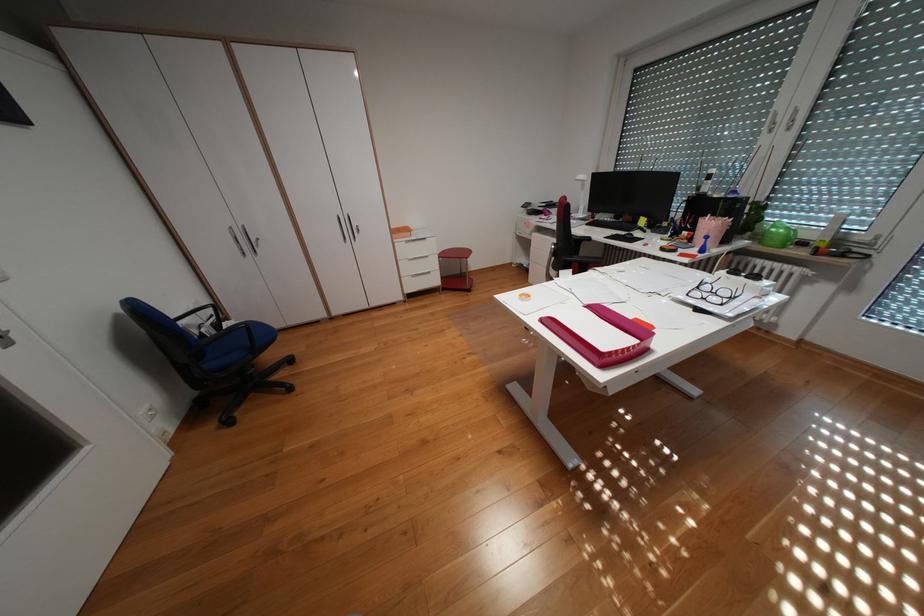
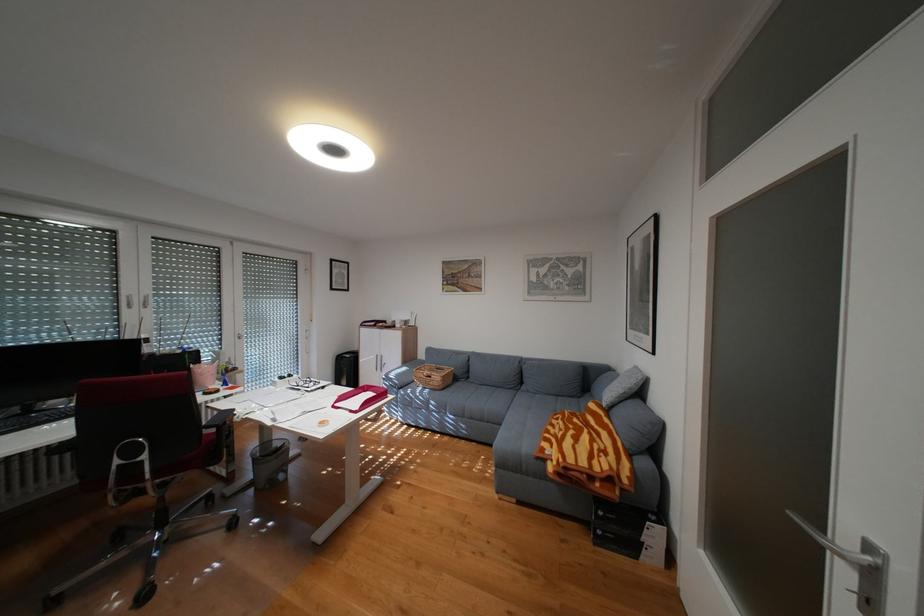
Locate, in the second image, the point that corresponds to pixel 750 274 in the first image.

(297, 377)